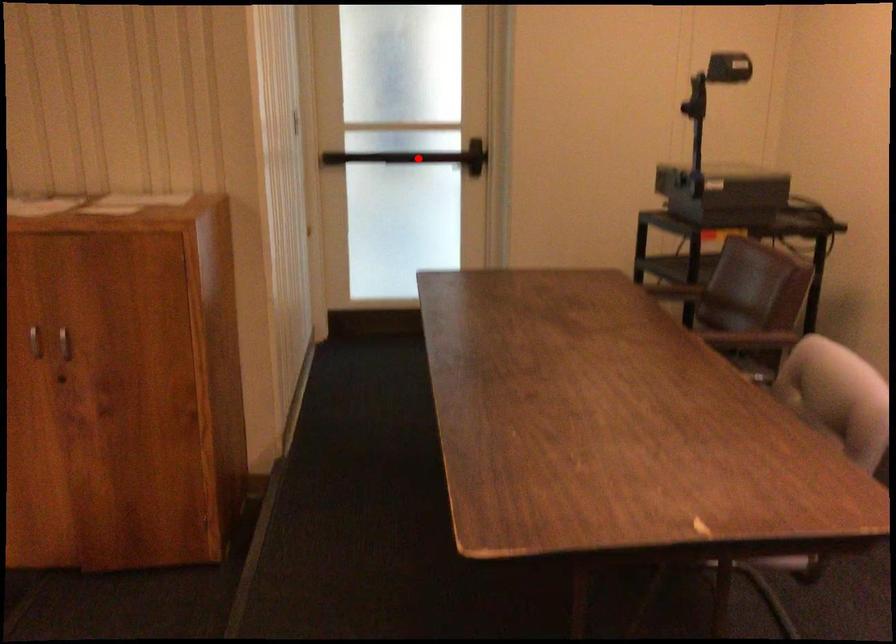
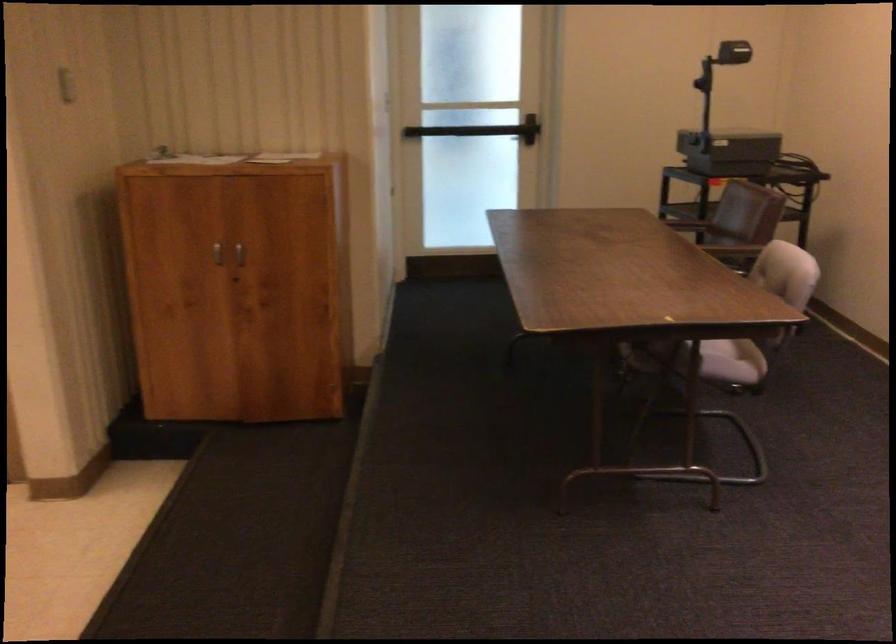
Question: I am providing you with two images of the same scene from different viewpoints. A red point is marked on the first image. Is the red point's position out of view in image 2?

Choices:
 (A) Yes
 (B) No

Answer: (B)